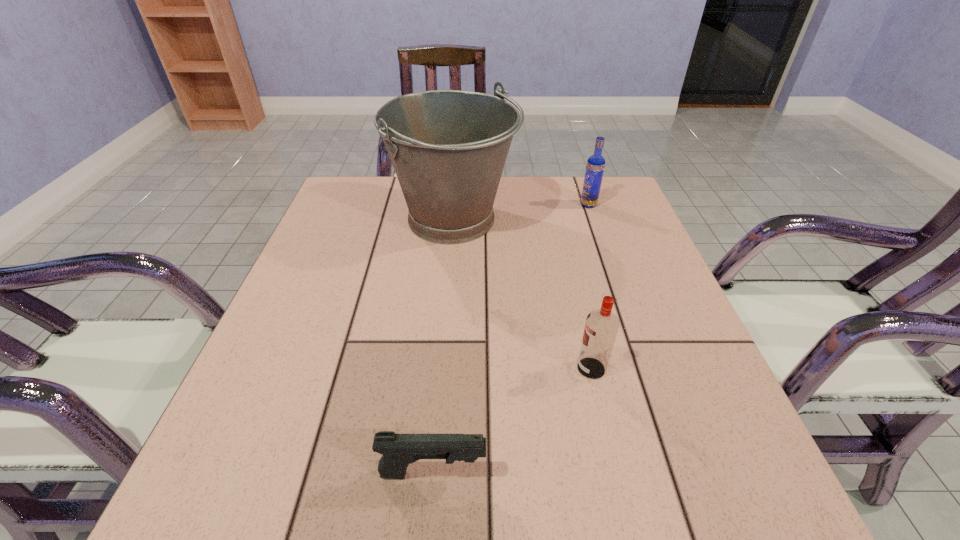
This screenshot has width=960, height=540. What are the coordinates of `free space located 0.380m on the front label of the nearer vodka` in the screenshot? It's located at (363, 368).

Where is `vacant space located 0.370m on the front label of the nearer vodka`? vacant space located 0.370m on the front label of the nearer vodka is located at coordinates (368, 368).

I want to click on free space located at the barrel of the nearest object, so click(x=527, y=474).

In order to click on bucket situated at the far edge in this screenshot , I will do pyautogui.click(x=448, y=148).

Find the location of a particular element. The image size is (960, 540). vodka that is positioned at the far edge is located at coordinates (595, 166).

You are a GUI agent. You are given a task and a screenshot of the screen. Output one action in this format:
    pyautogui.click(x=<x>, y=<y>)
    Task: Click on the object that is at the near edge
    The height and width of the screenshot is (540, 960).
    Given the screenshot: What is the action you would take?
    pyautogui.click(x=398, y=451)

Where is `object positioned at the right edge`? object positioned at the right edge is located at coordinates (595, 166).

Locate an element on the screen. object located at the far right corner is located at coordinates (595, 166).

I want to click on vacant space at the far edge of the desktop, so click(533, 179).

Locate an element on the screen. Image resolution: width=960 pixels, height=540 pixels. vacant point at the near edge is located at coordinates (322, 502).